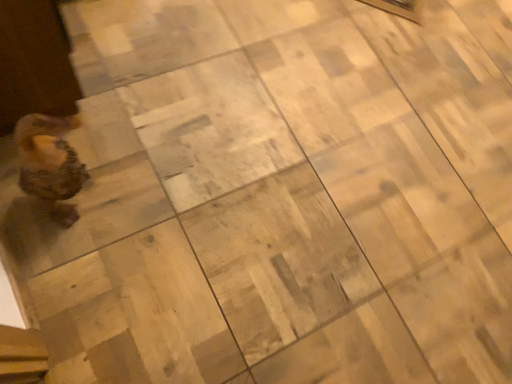
At what (x,y) coordinates should I click in order to perform the action: click on brown fabric at lower left. Please return your answer as a coordinate pair (x, y). Looking at the image, I should click on (38, 94).

Describe the element at coordinates (38, 94) in the screenshot. This screenshot has width=512, height=384. I see `brown fabric at lower left` at that location.

This screenshot has height=384, width=512. I want to click on brown fabric at lower left, so click(38, 94).